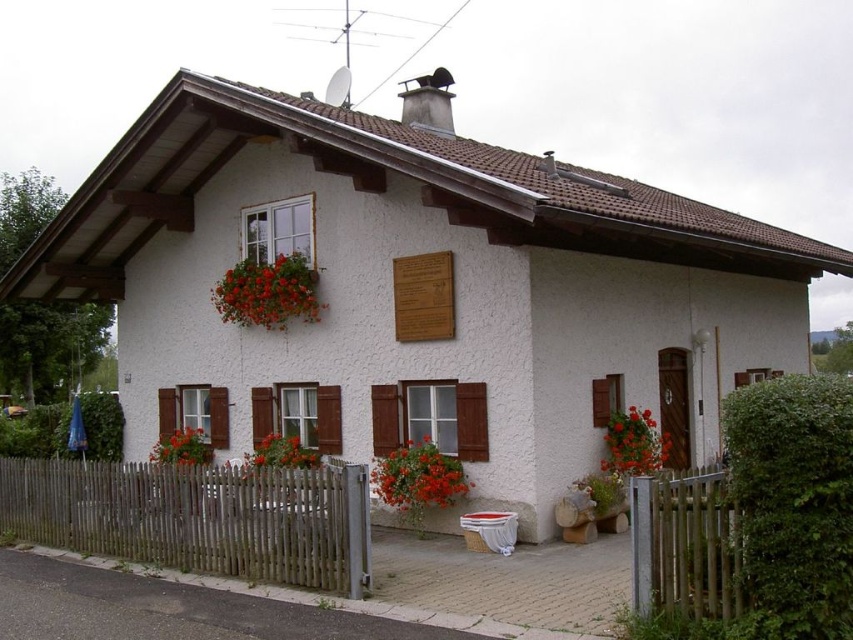
From the picture: You are a gardener with a 1.5 meter long garden hose. You need to water both the vivid red petals at center and the bright red flowers at lower left. Can your hose reach both from your current position at the fence?

The distance between the vivid red petals at center and the bright red flowers at lower left is 1.74 meters. Since your hose is only 1.5 meters long, it cannot reach both locations simultaneously. You will need to move closer to each one individually to water them.

You are standing in front of the house and notice two points marked on the wooden fence. The first point is at coordinate point (x=273, y=436) and the second is at coordinate point (x=165, y=436). Which point is closer to you?

Point (x=273, y=436) is closer to the viewer than point (x=165, y=436).

You are a gardener who wants to plant a new flower bed. You have two options for placement based on the image. The first option is near the floral fabric basket at upper left, and the second is near the bright orange flowers at lower right. Considering their heights, which location would allow for a taller flower bed?

The floral fabric basket at upper left is much taller than the bright orange flowers at lower right, so planting near the floral fabric basket at upper left would allow for a taller flower bed.